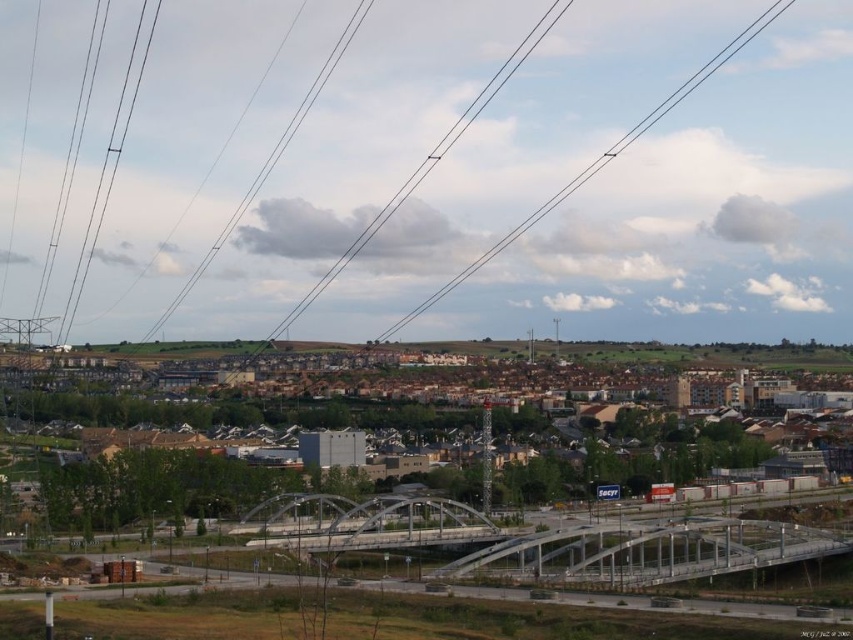
Question: From the image, what is the correct spatial relationship of metallic gray pedestrian bridge at center in relation to metallic gray bridge at center?

Choices:
 (A) above
 (B) below

Answer: (B)

Question: Is black wire at upper center positioned at the back of metallic gray bridge at center?

Choices:
 (A) no
 (B) yes

Answer: (B)

Question: Is black wire at upper center wider than metallic gray bridge at center?

Choices:
 (A) yes
 (B) no

Answer: (A)

Question: Among these points, which one is nearest to the camera?

Choices:
 (A) pyautogui.click(x=222, y=477)
 (B) pyautogui.click(x=608, y=573)
 (C) pyautogui.click(x=450, y=509)
 (D) pyautogui.click(x=318, y=145)

Answer: (B)

Question: Which point appears farthest from the camera in this image?

Choices:
 (A) (730, 538)
 (B) (801, 314)
 (C) (263, 536)
 (D) (654, 390)

Answer: (B)

Question: Which of these objects is positioned closest to the metallic gray bridge at center?

Choices:
 (A) brown brick buildings at center
 (B) metallic gray pedestrian bridge at center
 (C) black wire at upper center

Answer: (B)